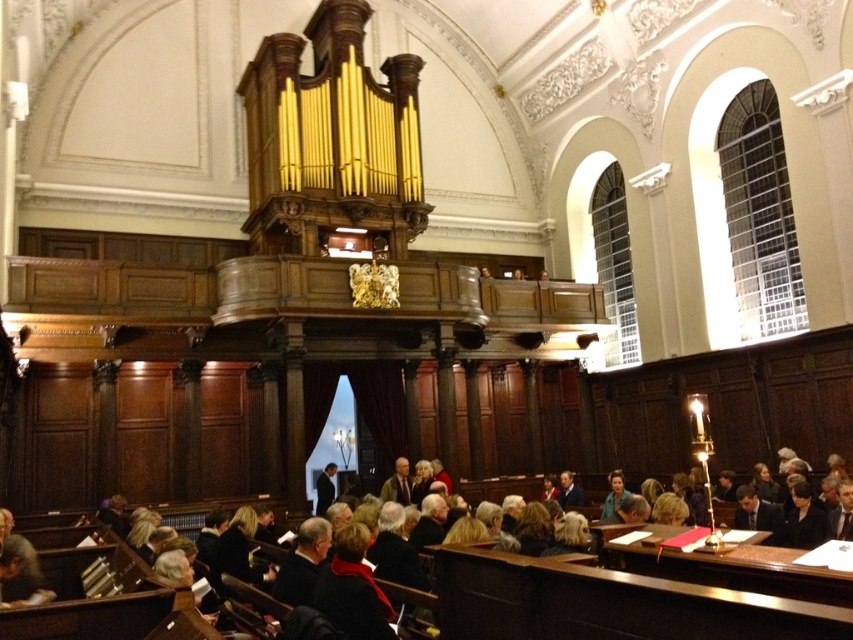
Based on the photo, you are a guest at a formal event in this historic building and see both the green fabric jacket at center and the dark brown leather jacket at center. Which one is located to the right when facing the jackets?

The green fabric jacket at center is positioned on the right side of the dark brown leather jacket at center, so it is located to the right when facing the jackets.

You are standing in the grand hall and see two leather jackets. The dark brown leather jacket at lower center and the light brown leather jacket at center. Which jacket is positioned to the right of the other?

The dark brown leather jacket at lower center is positioned to the right of the light brown leather jacket at center.

You are a stagehand preparing for a performance. You need to place a microphone stand between the green fabric jacket at center and the dark brown leather jacket at center. The microphone stand requires 3 feet of space around it to function properly. Can you fit it between them?

The green fabric jacket at center is 9.60 feet from the dark brown leather jacket at center. Since the microphone stand needs 3 feet of space, there is enough room between them to place it as the distance is greater than 3 feet.